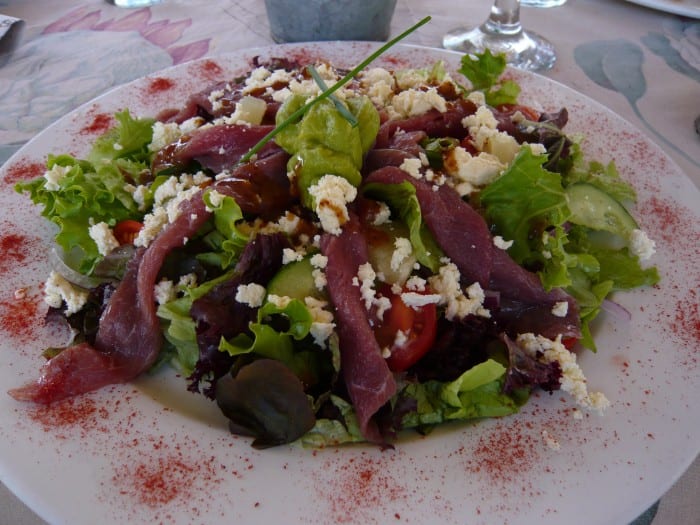
In order to click on food is served on in this screenshot , I will do `click(71, 467)`.